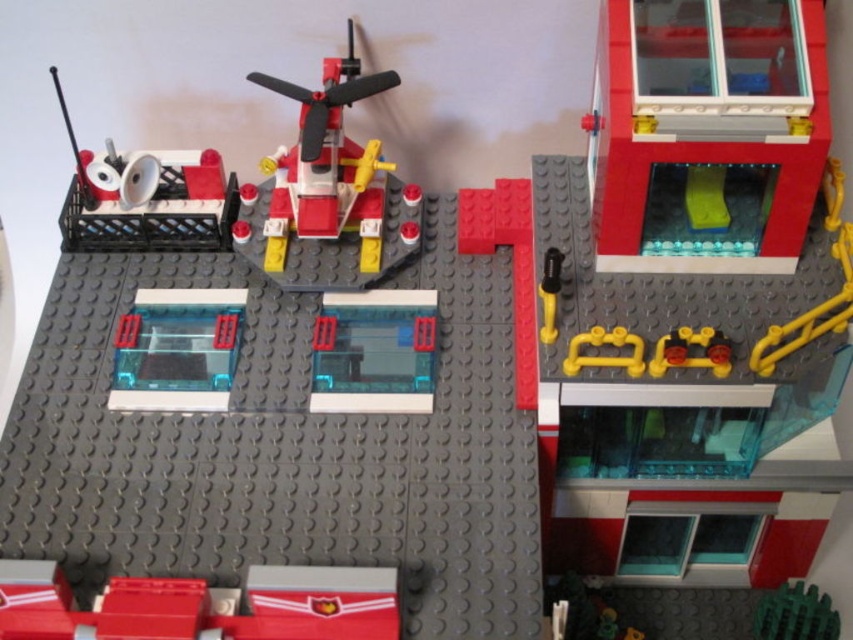
Question: Does shiny plastic helicopter at center appear on the right side of transparent plastic window at center?

Choices:
 (A) no
 (B) yes

Answer: (A)

Question: Which object is closer to the camera taking this photo?

Choices:
 (A) smooth plastic bricks at lower left
 (B) transparent plastic window at center

Answer: (A)

Question: Which of the following is the farthest from the observer?

Choices:
 (A) transparent plastic window at lower left
 (B) matte black speaker at upper left

Answer: (A)

Question: Among these points, which one is nearest to the camera?

Choices:
 (A) (352, 368)
 (B) (59, 625)

Answer: (B)

Question: Can you confirm if smooth plastic bricks at lower left is thinner than transparent plastic window at lower left?

Choices:
 (A) no
 (B) yes

Answer: (A)

Question: Is transparent plastic window at upper right in front of green rubber ball at lower right?

Choices:
 (A) no
 (B) yes

Answer: (B)